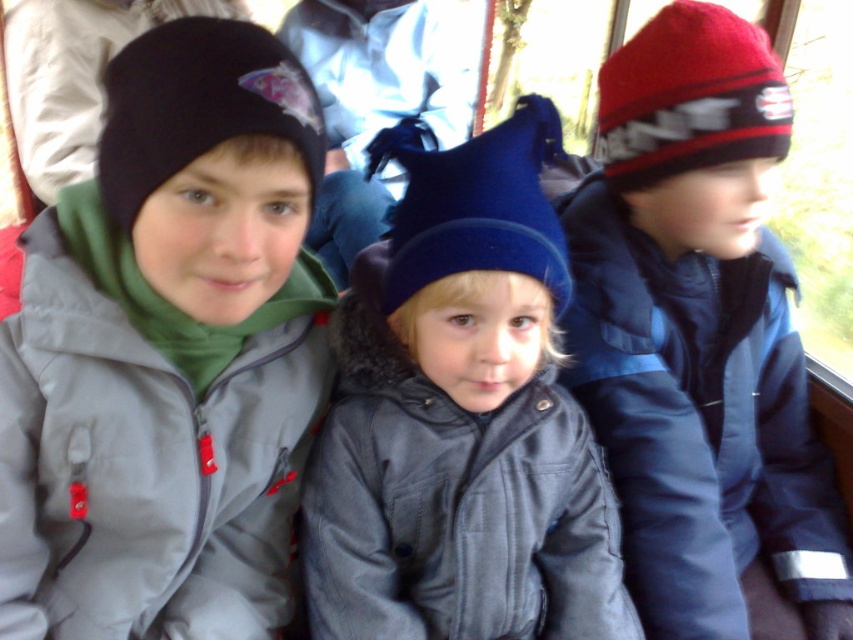
Question: Does red knit hat at right have a lesser width compared to velvet blue hat at center?

Choices:
 (A) yes
 (B) no

Answer: (B)

Question: Which object is the farthest from the matte gray jacket at left?

Choices:
 (A) red knit hat at right
 (B) velvet blue hat at center

Answer: (A)

Question: Is matte gray jacket at left further to the viewer compared to red knit hat at right?

Choices:
 (A) no
 (B) yes

Answer: (A)

Question: Which point is farther from the camera taking this photo?

Choices:
 (A) (375, 540)
 (B) (164, 612)
 (C) (752, 481)

Answer: (C)

Question: Does red knit hat at right appear over velvet blue hat at center?

Choices:
 (A) yes
 (B) no

Answer: (A)

Question: Which of these objects is positioned closest to the matte gray jacket at left?

Choices:
 (A) velvet blue hat at center
 (B) red knit hat at right

Answer: (A)